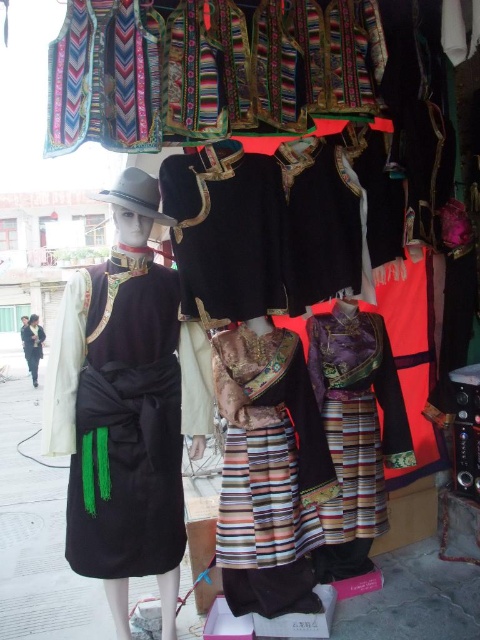
Question: Which point is closer to the camera taking this photo?

Choices:
 (A) (32, 348)
 (B) (264, 492)

Answer: (B)

Question: Considering the relative positions of velvet black dress at center and purple satin dress at center in the image provided, where is velvet black dress at center located with respect to purple satin dress at center?

Choices:
 (A) above
 (B) below

Answer: (A)

Question: Does velvet black dress at center come in front of velvet striped skirt at center?

Choices:
 (A) no
 (B) yes

Answer: (B)

Question: Which of the following is the farthest from the observer?

Choices:
 (A) velvet striped skirt at center
 (B) velvet black dress at center
 (C) black velvet dress at left

Answer: (C)

Question: Considering the relative positions of velvet black dress at center and velvet striped skirt at center in the image provided, where is velvet black dress at center located with respect to velvet striped skirt at center?

Choices:
 (A) right
 (B) left

Answer: (B)

Question: Which object is closer to the camera taking this photo?

Choices:
 (A) purple satin dress at center
 (B) velvet striped skirt at center
 (C) black velvet dress at left

Answer: (B)